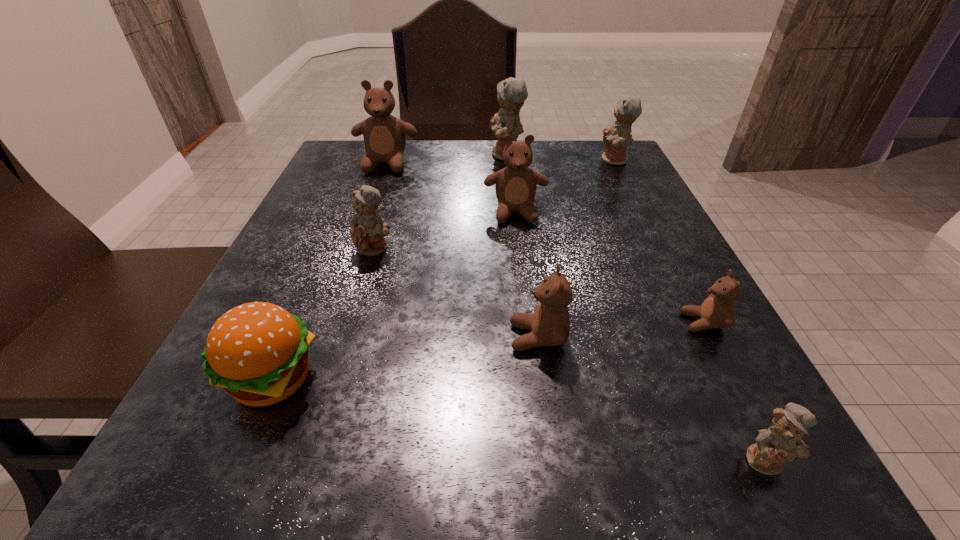
Where is `teddy bear object that ranks as the closest to the second blue teddy bear from left to right`? The height and width of the screenshot is (540, 960). teddy bear object that ranks as the closest to the second blue teddy bear from left to right is located at coordinates (516, 184).

The width and height of the screenshot is (960, 540). In order to click on teddy bear that is the nearest to the nearest blue teddy bear in this screenshot , I will do `click(717, 311)`.

The height and width of the screenshot is (540, 960). I want to click on the fourth closest blue teddy bear relative to the fifth nearest teddy bear, so click(x=782, y=440).

You are a GUI agent. You are given a task and a screenshot of the screen. Output one action in this format:
    pyautogui.click(x=<x>, y=<y>)
    Task: Click on the blue teddy bear that is the closest one to the rightmost brown teddy bear
    Image resolution: width=960 pixels, height=540 pixels.
    Given the screenshot: What is the action you would take?
    pyautogui.click(x=782, y=440)

Locate an element on the screen. brown teddy bear that is the second closest to the third smallest blue teddy bear is located at coordinates (384, 136).

Where is `brown teddy bear that stands as the closest to the second biggest blue teddy bear`? This screenshot has width=960, height=540. brown teddy bear that stands as the closest to the second biggest blue teddy bear is located at coordinates tap(516, 184).

Locate an element on the screen. Image resolution: width=960 pixels, height=540 pixels. free space that satisfies the following two spatial constraints: 1. on the front-facing side of the third biggest brown teddy bear; 2. on the front side of the hamburger is located at coordinates (543, 379).

You are a GUI agent. You are given a task and a screenshot of the screen. Output one action in this format:
    pyautogui.click(x=<x>, y=<y>)
    Task: Click on the vacant region that satisfies the following two spatial constraints: 1. on the front-facing side of the second biggest blue teddy bear; 2. on the front-facing side of the fourth farthest object
    This screenshot has height=540, width=960.
    Given the screenshot: What is the action you would take?
    pyautogui.click(x=641, y=212)

The width and height of the screenshot is (960, 540). I want to click on vacant area that satisfies the following two spatial constraints: 1. on the front-facing side of the biggest blue teddy bear; 2. on the front-facing side of the fourth nearest teddy bear, so click(x=516, y=248).